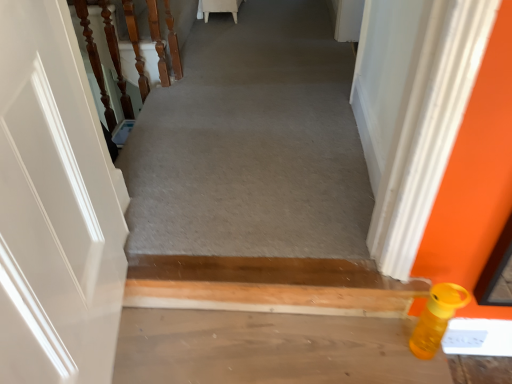
Question: Considering the positions of smooth concrete floor at lower right and matte plastic bottle at lower right in the image, is smooth concrete floor at lower right taller or shorter than matte plastic bottle at lower right?

Choices:
 (A) tall
 (B) short

Answer: (A)

Question: Is point (131, 339) positioned closer to the camera than point (220, 76)?

Choices:
 (A) farther
 (B) closer

Answer: (B)

Question: Estimate the real-world distances between objects in this image. Which object is farther from the wooden balusters at left?

Choices:
 (A) yellow matte bottle at lower right
 (B) smooth concrete floor at lower right
 (C) matte plastic bottle at lower right

Answer: (A)

Question: Which is farther from the wooden balusters at left?

Choices:
 (A) yellow matte bottle at lower right
 (B) matte plastic bottle at lower right
 (C) smooth concrete floor at lower right

Answer: (A)